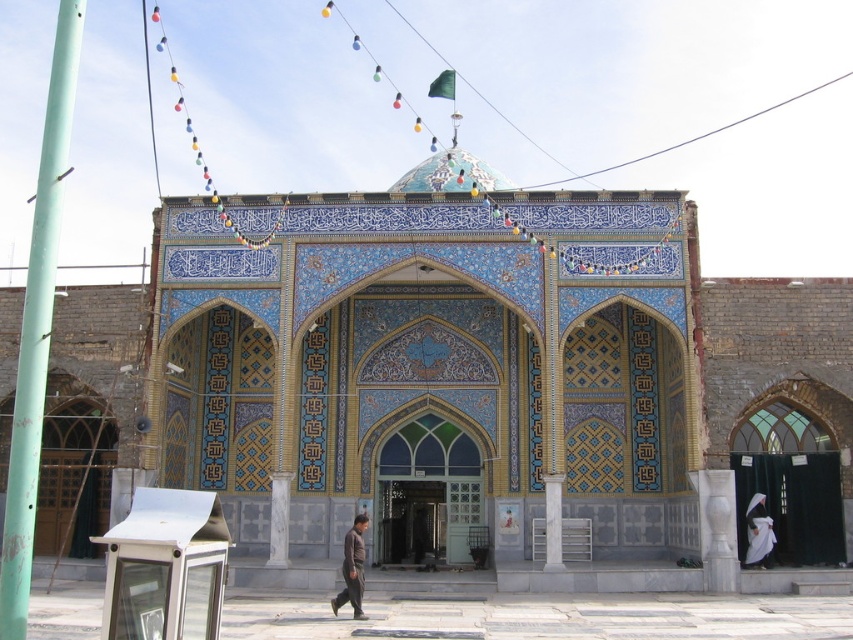
Question: Which point appears closest to the camera in this image?

Choices:
 (A) (763, 525)
 (B) (56, 108)
 (C) (358, 522)

Answer: (B)

Question: Is green painted metal pole at left behind dark brown fabric at center?

Choices:
 (A) yes
 (B) no

Answer: (B)

Question: Considering the real-world distances, which object is farthest from the dark brown fabric at center?

Choices:
 (A) white fabric at right
 (B) green painted metal pole at left

Answer: (B)

Question: Estimate the real-world distances between objects in this image. Which object is farther from the dark brown fabric at center?

Choices:
 (A) green painted metal pole at left
 (B) white fabric at right

Answer: (A)

Question: Is green painted metal pole at left closer to camera compared to white fabric at right?

Choices:
 (A) no
 (B) yes

Answer: (B)

Question: Can you confirm if green painted metal pole at left is thinner than white fabric at right?

Choices:
 (A) no
 (B) yes

Answer: (A)